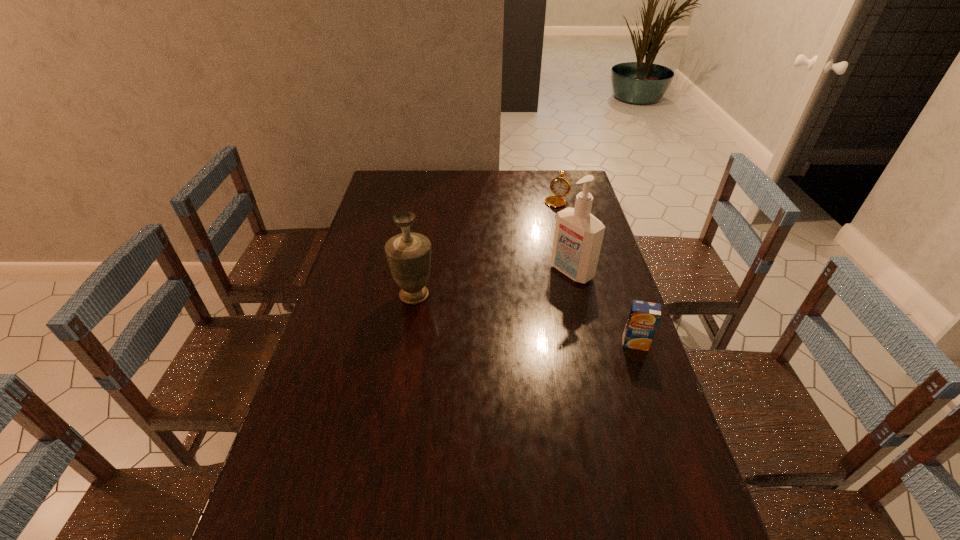
Where is `vacant space that's between the farthest object and the orange_juice`? The height and width of the screenshot is (540, 960). vacant space that's between the farthest object and the orange_juice is located at coordinates tap(599, 273).

Where is `free spot between the nearest object and the pocket watch`? This screenshot has height=540, width=960. free spot between the nearest object and the pocket watch is located at coordinates (599, 273).

The height and width of the screenshot is (540, 960). I want to click on vacant point located between the tallest object and the nearest object, so click(x=604, y=307).

Where is `unoccupied area between the shortest object and the leftmost object`? unoccupied area between the shortest object and the leftmost object is located at coordinates (489, 248).

I want to click on free spot between the nearest object and the shortest object, so click(x=599, y=273).

Where is `object that ranks as the closest to the tallest object`? object that ranks as the closest to the tallest object is located at coordinates (644, 317).

I want to click on the second closest object to the pocket watch, so click(x=408, y=254).

The image size is (960, 540). Identify the location of vacant area in the image that satisfies the following two spatial constraints: 1. on the back side of the farthest object; 2. on the left side of the cleansing agent. (555, 202).

Where is `free space that satisfies the following two spatial constraints: 1. on the front side of the nearest object; 2. on the left side of the tallest object`? The width and height of the screenshot is (960, 540). free space that satisfies the following two spatial constraints: 1. on the front side of the nearest object; 2. on the left side of the tallest object is located at coordinates (589, 343).

This screenshot has width=960, height=540. Find the location of `free space that satisfies the following two spatial constraints: 1. on the back side of the third shortest object; 2. on the right side of the tallest object`. free space that satisfies the following two spatial constraints: 1. on the back side of the third shortest object; 2. on the right side of the tallest object is located at coordinates (418, 272).